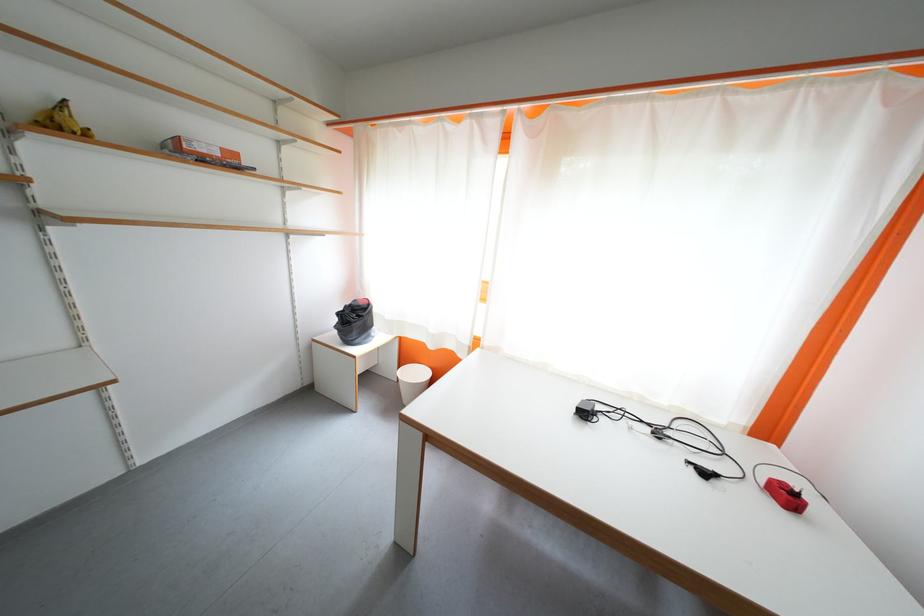
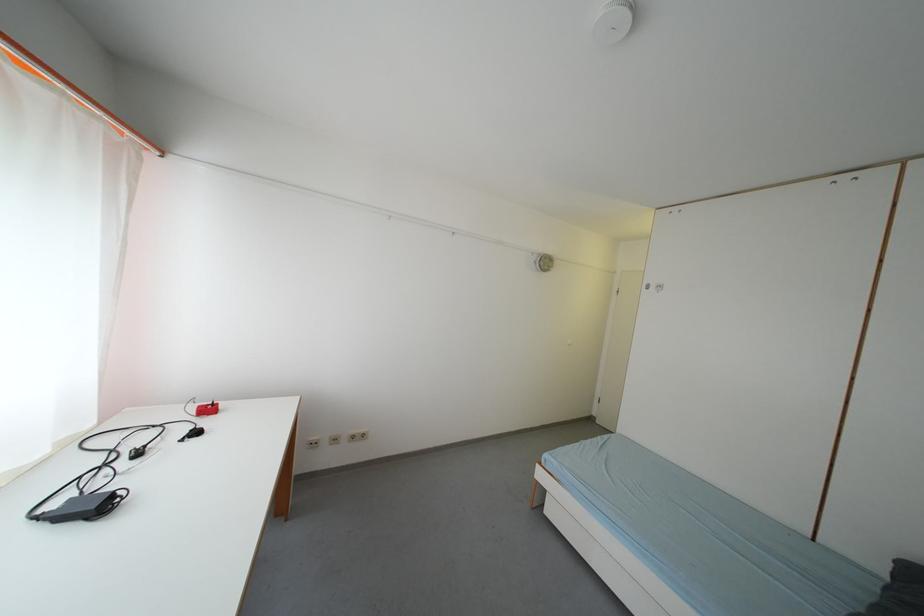
In the second image, find the point that corresponds to the point at 650,424 in the first image.

(112, 469)